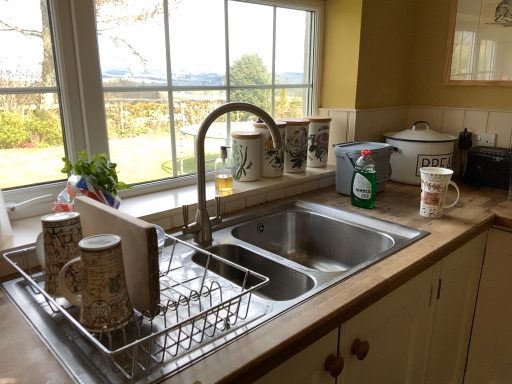
What do you see at coordinates (356, 160) in the screenshot?
I see `green plastic container at upper right, positioned as the 2th appliance in front-to-back order` at bounding box center [356, 160].

What is the approximate width of black plastic toaster at right, which is the 1th appliance from right to left?

It is 14.86 centimeters.

Measure the distance between white ceramic mug at right, placed as the 1th mug when sorted from back to front, and camera.

white ceramic mug at right, placed as the 1th mug when sorted from back to front, is 4.50 feet away from camera.

Describe the element at coordinates (79, 76) in the screenshot. The height and width of the screenshot is (384, 512). I see `clear glass window at upper center, the 1th window from the left` at that location.

The image size is (512, 384). What are the coordinates of `clear glass window at upper center, which is counted as the second window, starting from the right` in the screenshot? It's located at tap(79, 76).

Where is `metallic dish rack at lower left, which is the 1th appliance in left-to-right order`? metallic dish rack at lower left, which is the 1th appliance in left-to-right order is located at coordinates (145, 317).

Is porcelain floral canisters at upper right, the fourth appliance when ordered from front to back, outside of brushed metal faucet at center?

Yes, porcelain floral canisters at upper right, the fourth appliance when ordered from front to back, is not within brushed metal faucet at center.

At what (x,y) coordinates should I click in order to perform the action: click on tap located above the porcelain floral canisters at upper right, which is the third appliance in right-to-left order (from a real-world perspective). Please return your answer as a coordinate pair (x, y). Looking at the image, I should click on (204, 169).

From a real-world perspective, is porcelain floral canisters at upper right, acting as the first appliance starting from the back, positioned under brushed metal faucet at center based on gravity?

Indeed, from a real-world perspective, porcelain floral canisters at upper right, acting as the first appliance starting from the back, is positioned beneath brushed metal faucet at center.

How many degrees apart are the facing directions of porcelain floral canisters at upper right, acting as the first appliance starting from the back, and brushed metal faucet at center?

0.00262 degrees.

Which is more to the right, metallic dish rack at lower left, which ranks as the 4th appliance in back-to-front order, or clear glass window at upper center, the 1th window from the left?

clear glass window at upper center, the 1th window from the left, is more to the right.

Can you confirm if metallic dish rack at lower left, the 4th appliance in the right-to-left sequence, is thinner than clear glass window at upper center, the 1th window from the left?

Incorrect, the width of metallic dish rack at lower left, the 4th appliance in the right-to-left sequence, is not less than that of clear glass window at upper center, the 1th window from the left.

Considering the sizes of objects metallic dish rack at lower left, which ranks as the 4th appliance in back-to-front order, and clear glass window at upper center, which is counted as the second window, starting from the right, in the image provided, who is taller, metallic dish rack at lower left, which ranks as the 4th appliance in back-to-front order, or clear glass window at upper center, which is counted as the second window, starting from the right,?

clear glass window at upper center, which is counted as the second window, starting from the right.

Would you consider metallic dish rack at lower left, which is counted as the 1th appliance, starting from the front, to be distant from clear glass window at upper center, which is counted as the second window, starting from the right?

No.

Based on the photo, from a real-world perspective, is porcelain floral canisters at upper right, which is the third appliance in right-to-left order, positioned above or below white enamel pot at right?

Clearly, from a real-world perspective, porcelain floral canisters at upper right, which is the third appliance in right-to-left order, is above white enamel pot at right.

From the image's perspective, which object appears higher, porcelain floral canisters at upper right, which ranks as the 2th appliance in left-to-right order, or white enamel pot at right?

porcelain floral canisters at upper right, which ranks as the 2th appliance in left-to-right order, from the image's perspective.

Between porcelain floral canisters at upper right, the fourth appliance when ordered from front to back, and white enamel pot at right, which one has smaller size?

porcelain floral canisters at upper right, the fourth appliance when ordered from front to back.

In the image, is porcelain floral canisters at upper right, acting as the first appliance starting from the back, on the left side or the right side of white enamel pot at right?

porcelain floral canisters at upper right, acting as the first appliance starting from the back, is to the left of white enamel pot at right.

Is white enamel pot at right not within brown ceramic mug at left, placed as the 1th mug when sorted from front to back?

That's correct, white enamel pot at right is outside of brown ceramic mug at left, placed as the 1th mug when sorted from front to back.

Considering the relative sizes of white enamel pot at right and brown ceramic mug at left, the second mug when ordered from top to bottom, in the image provided, is white enamel pot at right smaller than brown ceramic mug at left, the second mug when ordered from top to bottom,?

Incorrect, white enamel pot at right is not smaller in size than brown ceramic mug at left, the second mug when ordered from top to bottom.

What's the angular difference between white enamel pot at right and brown ceramic mug at left, which is the 1th mug in bottom-to-top order,'s facing directions?

0.00347 degrees separate the facing orientations of white enamel pot at right and brown ceramic mug at left, which is the 1th mug in bottom-to-top order.

Are white enamel pot at right and brown ceramic mug at left, the second mug when ordered from top to bottom, located far from each other?

Indeed, white enamel pot at right is not near brown ceramic mug at left, the second mug when ordered from top to bottom.

From their relative heights in the image, would you say brushed metal faucet at center is taller or shorter than transparent glass window at upper right, which is the first window from right to left?

In the image, brushed metal faucet at center appears to be shorter than transparent glass window at upper right, which is the first window from right to left.

Where is `window on the right of brushed metal faucet at center`? window on the right of brushed metal faucet at center is located at coordinates [x=480, y=43].

Consider the image. Is brushed metal faucet at center not inside transparent glass window at upper right, which is the first window from right to left?

Yes, brushed metal faucet at center is outside of transparent glass window at upper right, which is the first window from right to left.

Is brushed metal faucet at center turned away from transparent glass window at upper right, which is the first window from right to left?

No, brushed metal faucet at center is not facing the opposite direction of transparent glass window at upper right, which is the first window from right to left.

Is white enamel pot at right bigger than metallic dish rack at lower left, the 4th appliance in the right-to-left sequence?

Indeed, white enamel pot at right has a larger size compared to metallic dish rack at lower left, the 4th appliance in the right-to-left sequence.

Is white enamel pot at right looking in the opposite direction of metallic dish rack at lower left, which ranks as the 4th appliance in back-to-front order?

That's not correct — white enamel pot at right is not looking away from metallic dish rack at lower left, which ranks as the 4th appliance in back-to-front order.

Is white enamel pot at right not inside metallic dish rack at lower left, the 4th appliance in the right-to-left sequence?

That's correct, white enamel pot at right is outside of metallic dish rack at lower left, the 4th appliance in the right-to-left sequence.

From the image's perspective, between white enamel pot at right and green translucent bottle at right, which one is located above?

white enamel pot at right.

Which of these two, white enamel pot at right or green translucent bottle at right, is smaller?

With smaller size is green translucent bottle at right.

Which object is further away from the camera, white enamel pot at right or green translucent bottle at right?

white enamel pot at right is behind.

Is white enamel pot at right oriented towards green translucent bottle at right?

No.

Locate an element on the screen. This screenshot has height=384, width=512. tap above the porcelain floral canisters at upper right, which ranks as the 2th appliance in left-to-right order (from a real-world perspective) is located at coordinates (204, 169).

Find the location of `the 1st window counting from the right of the metallic dish rack at lower left, which is counted as the 1th appliance, starting from the front`. the 1st window counting from the right of the metallic dish rack at lower left, which is counted as the 1th appliance, starting from the front is located at coordinates (79, 76).

Estimate the real-world distances between objects in this image. Which object is further from white ceramic mug at right, marked as the second mug in a bottom-to-top arrangement, transparent glass window at upper right, which is the first window from right to left, or brown ceramic mug at left, the second mug when ordered from top to bottom?

brown ceramic mug at left, the second mug when ordered from top to bottom, is further to white ceramic mug at right, marked as the second mug in a bottom-to-top arrangement.

When comparing their distances from brushed metal faucet at center, does brown ceramic mug at left, placed as the 1th mug when sorted from front to back, or porcelain floral canisters at upper right, which is the third appliance in right-to-left order, seem further?

Among the two, brown ceramic mug at left, placed as the 1th mug when sorted from front to back, is located further to brushed metal faucet at center.

When comparing their distances from transparent glass window at upper right, which is the 2th window in left-to-right order, does metallic dish rack at lower left, which is the 1th appliance in left-to-right order, or clear glass window at upper center, which is counted as the second window, starting from the right, seem closer?

The object closer to transparent glass window at upper right, which is the 2th window in left-to-right order, is clear glass window at upper center, which is counted as the second window, starting from the right.

From the image, which object appears to be farther from green plastic container at upper right, positioned as the 2th appliance in right-to-left order, black plastic toaster at right, acting as the 3th appliance starting from the front, or white enamel pot at right?

black plastic toaster at right, acting as the 3th appliance starting from the front, lies further to green plastic container at upper right, positioned as the 2th appliance in right-to-left order, than the other object.

Looking at the image, which one is located closer to brown ceramic mug at left, placed as the 1th mug when sorted from left to right, white ceramic mug at right, the second mug in the left-to-right sequence, or metallic dish rack at lower left, which is counted as the 1th appliance, starting from the front?

Among the two, metallic dish rack at lower left, which is counted as the 1th appliance, starting from the front, is located nearer to brown ceramic mug at left, placed as the 1th mug when sorted from left to right.

Based on their spatial positions, is black plastic toaster at right, the 2th appliance when ordered from back to front, or green translucent bottle at right closer to clear glass window at upper center, which is counted as the second window, starting from the right?

The object closer to clear glass window at upper center, which is counted as the second window, starting from the right, is green translucent bottle at right.

When comparing their distances from green plastic container at upper right, positioned as the 2th appliance in front-to-back order, does transparent glass window at upper right, which is the first window from right to left, or white ceramic mug at right, placed as the 1th mug when sorted from back to front, seem closer?

white ceramic mug at right, placed as the 1th mug when sorted from back to front, is positioned closer to the anchor green plastic container at upper right, positioned as the 2th appliance in front-to-back order.

From the image, which object appears to be farther from clear glass window at upper center, which is counted as the second window, starting from the right, white ceramic mug at right, marked as the second mug in a bottom-to-top arrangement, or wooden at left?

white ceramic mug at right, marked as the second mug in a bottom-to-top arrangement, is further to clear glass window at upper center, which is counted as the second window, starting from the right.

Where is `kitchen appliance between metallic dish rack at lower left, which is counted as the 1th appliance, starting from the front, and transparent glass window at upper right, which is the 2th window in left-to-right order, from left to right`? The width and height of the screenshot is (512, 384). kitchen appliance between metallic dish rack at lower left, which is counted as the 1th appliance, starting from the front, and transparent glass window at upper right, which is the 2th window in left-to-right order, from left to right is located at coordinates (418, 152).

You are a GUI agent. You are given a task and a screenshot of the screen. Output one action in this format:
    pyautogui.click(x=<x>, y=<y>)
    Task: Click on the tap between brown ceramic mug at left, which is the 1th mug in bottom-to-top order, and porcelain floral canisters at upper right, which ranks as the 2th appliance in left-to-right order, from front to back
    
    Given the screenshot: What is the action you would take?
    pyautogui.click(x=204, y=169)

Where is `mug between brushed metal faucet at center and porcelain floral canisters at upper right, which is the third appliance in right-to-left order, along the z-axis`? The image size is (512, 384). mug between brushed metal faucet at center and porcelain floral canisters at upper right, which is the third appliance in right-to-left order, along the z-axis is located at coordinates (435, 191).

Locate an element on the screen. The image size is (512, 384). appliance between brown ceramic mug at left, the second mug when ordered from top to bottom, and wooden at left in the up-down direction is located at coordinates (145, 317).